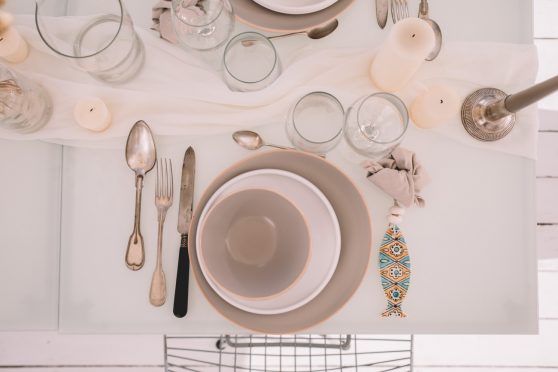
What are the coordinates of `floor boards` in the screenshot? It's located at (75, 347), (86, 367), (550, 294), (546, 258), (548, 206), (542, 153), (547, 118), (549, 53), (542, 26).